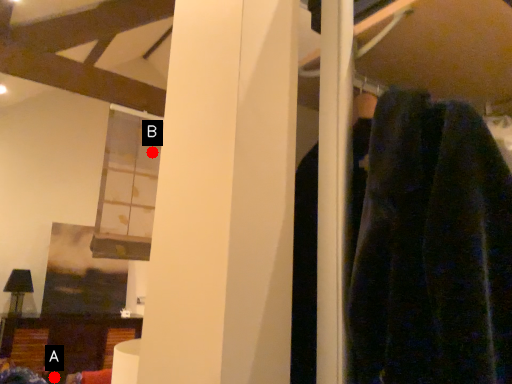
Question: Two points are circled on the image, labeled by A and B beside each circle. Which point is closer to the camera?

Choices:
 (A) A is closer
 (B) B is closer

Answer: (B)